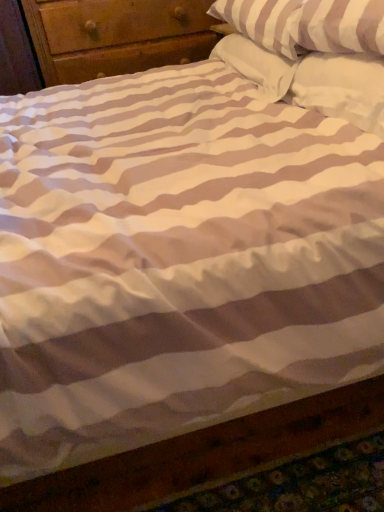
Consider the image. How much space does white striped pillow at upper right, which is counted as the second pillow, starting from the back, occupy horizontally?

It is 19.53 inches.

The height and width of the screenshot is (512, 384). In order to click on white soft pillow at upper right, the first pillow when ordered from front to back in this screenshot , I will do `click(342, 88)`.

Is white soft pillow at upper right, which is the 1th pillow from back to front, wider or thinner than white soft pillow at upper right, the 3th pillow in the back-to-front sequence?

white soft pillow at upper right, which is the 1th pillow from back to front, is wider than white soft pillow at upper right, the 3th pillow in the back-to-front sequence.

Do you think white soft pillow at upper right, which is the 1th pillow from back to front, is within white soft pillow at upper right, the first pillow when ordered from front to back, or outside of it?

white soft pillow at upper right, which is the 1th pillow from back to front, is not inside white soft pillow at upper right, the first pillow when ordered from front to back, it's outside.

Is point (331, 87) positioned behind point (344, 84)?

Yes, point (331, 87) is farther from viewer.

Between white soft pillow at upper right, which is the 1th pillow from back to front, and white soft pillow at upper right, the first pillow when ordered from front to back, which one appears on the left side from the viewer's perspective?

white soft pillow at upper right, which is the 1th pillow from back to front, is more to the left.

Is white soft pillow at upper right, the first pillow when ordered from front to back, next to white soft pillow at upper right, the 3th pillow viewed from the front?

Yes, white soft pillow at upper right, the first pillow when ordered from front to back, is beside white soft pillow at upper right, the 3th pillow viewed from the front.

Between white soft pillow at upper right, the 3th pillow in the back-to-front sequence, and white soft pillow at upper right, the 3th pillow viewed from the front, which one appears on the right side from the viewer's perspective?

white soft pillow at upper right, the 3th pillow in the back-to-front sequence.

From a real-world perspective, between white soft pillow at upper right, the first pillow when ordered from front to back, and white soft pillow at upper right, the 3th pillow viewed from the front, who is vertically higher?

white soft pillow at upper right, the first pillow when ordered from front to back, is physically above.

Does point (338, 116) appear closer or farther from the camera than point (332, 38)?

Point (338, 116) is closer to the camera than point (332, 38).

Is white striped pillow at upper right, which is counted as the second pillow, starting from the back, inside white soft pillow at upper right, the first pillow when ordered from front to back?

No, white striped pillow at upper right, which is counted as the second pillow, starting from the back, is located outside of white soft pillow at upper right, the first pillow when ordered from front to back.

Considering the sizes of objects white soft pillow at upper right, the 3th pillow in the back-to-front sequence, and white striped pillow at upper right, the 2th pillow viewed from the front, in the image provided, who is smaller, white soft pillow at upper right, the 3th pillow in the back-to-front sequence, or white striped pillow at upper right, the 2th pillow viewed from the front,?

With smaller size is white soft pillow at upper right, the 3th pillow in the back-to-front sequence.

Does white soft pillow at upper right, the 3th pillow in the back-to-front sequence, have a lesser width compared to white striped pillow at upper right, the 2th pillow viewed from the front?

Yes.

Is white striped pillow at upper right, the 2th pillow viewed from the front, not near white soft pillow at upper right, the 3th pillow in the back-to-front sequence?

No, white striped pillow at upper right, the 2th pillow viewed from the front, is not far away from white soft pillow at upper right, the 3th pillow in the back-to-front sequence.

Consider the image. From a real-world perspective, is white striped pillow at upper right, which is counted as the second pillow, starting from the back, located higher than white soft pillow at upper right, the first pillow when ordered from front to back?

Yes, from a real-world perspective, white striped pillow at upper right, which is counted as the second pillow, starting from the back, is over white soft pillow at upper right, the first pillow when ordered from front to back

Based on the photo, between white striped pillow at upper right, the 2th pillow viewed from the front, and white soft pillow at upper right, the first pillow when ordered from front to back, which one has less height?

white soft pillow at upper right, the first pillow when ordered from front to back, is shorter.

Is white striped pillow at upper right, the 2th pillow viewed from the front, oriented away from white soft pillow at upper right, the 3th pillow in the back-to-front sequence?

No, white soft pillow at upper right, the 3th pillow in the back-to-front sequence, is not at the back of white striped pillow at upper right, the 2th pillow viewed from the front.

Which is correct: white soft pillow at upper right, which is the 1th pillow from back to front, is inside white striped pillow at upper right, the 2th pillow viewed from the front, or outside of it?

white soft pillow at upper right, which is the 1th pillow from back to front, lies outside white striped pillow at upper right, the 2th pillow viewed from the front.

Consider the image. Which of these two, white soft pillow at upper right, which is the 1th pillow from back to front, or white striped pillow at upper right, the 2th pillow viewed from the front, is thinner?

With smaller width is white soft pillow at upper right, which is the 1th pillow from back to front.

Is white soft pillow at upper right, which is the 1th pillow from back to front, beside white striped pillow at upper right, which is counted as the second pillow, starting from the back?

Yes.

From the image's perspective, would you say white soft pillow at upper right, the 3th pillow viewed from the front, is shown under white striped pillow at upper right, the 2th pillow viewed from the front?

Yes.

Looking at this image, which is in front, white striped pillow at upper right, the 2th pillow viewed from the front, or white soft pillow at upper right, the 3th pillow viewed from the front?

white striped pillow at upper right, the 2th pillow viewed from the front.

From a real-world perspective, which object stands above the other?

Answer: white striped pillow at upper right, the 2th pillow viewed from the front, is physically above.

The width and height of the screenshot is (384, 512). I want to click on pillow that is the 1st one above the white soft pillow at upper right, the 3th pillow viewed from the front (from a real-world perspective), so [342, 88].

Locate an element on the screen. pillow that is the 1st object to the left of the white soft pillow at upper right, the first pillow when ordered from front to back, starting at the anchor is located at coordinates (313, 80).

Looking at the image, which one is located further to white soft pillow at upper right, the 3th pillow viewed from the front, white striped pillow at upper right, which is counted as the second pillow, starting from the back, or white soft pillow at upper right, the 3th pillow in the back-to-front sequence?

The object further to white soft pillow at upper right, the 3th pillow viewed from the front, is white striped pillow at upper right, which is counted as the second pillow, starting from the back.

Estimate the real-world distances between objects in this image. Which object is closer to white striped pillow at upper right, which is counted as the second pillow, starting from the back, white soft pillow at upper right, which is the 1th pillow from back to front, or white soft pillow at upper right, the 3th pillow in the back-to-front sequence?

Based on the image, white soft pillow at upper right, which is the 1th pillow from back to front, appears to be nearer to white striped pillow at upper right, which is counted as the second pillow, starting from the back.

Based on their spatial positions, is white soft pillow at upper right, the first pillow when ordered from front to back, or white striped pillow at upper right, which is counted as the second pillow, starting from the back, closer to white soft pillow at upper right, which is the 1th pillow from back to front?

white soft pillow at upper right, the first pillow when ordered from front to back, is positioned closer to the anchor white soft pillow at upper right, which is the 1th pillow from back to front.

In the scene shown: From the image, which object appears to be farther from white striped pillow at upper right, the 2th pillow viewed from the front, white soft pillow at upper right, the first pillow when ordered from front to back, or white soft pillow at upper right, which is the 1th pillow from back to front?

white soft pillow at upper right, the first pillow when ordered from front to back, is further to white striped pillow at upper right, the 2th pillow viewed from the front.

Estimate the real-world distances between objects in this image. Which object is further from white soft pillow at upper right, the 3th pillow in the back-to-front sequence, white striped pillow at upper right, which is counted as the second pillow, starting from the back, or white soft pillow at upper right, which is the 1th pillow from back to front?

Based on the image, white striped pillow at upper right, which is counted as the second pillow, starting from the back, appears to be further to white soft pillow at upper right, the 3th pillow in the back-to-front sequence.

Looking at the image, which one is located further to white soft pillow at upper right, the 3th pillow in the back-to-front sequence, white soft pillow at upper right, the 3th pillow viewed from the front, or white striped pillow at upper right, which is counted as the second pillow, starting from the back?

Among the two, white striped pillow at upper right, which is counted as the second pillow, starting from the back, is located further to white soft pillow at upper right, the 3th pillow in the back-to-front sequence.

Find the location of a particular element. The image size is (384, 512). pillow positioned between white soft pillow at upper right, the 3th pillow in the back-to-front sequence, and white soft pillow at upper right, which is the 1th pillow from back to front, from near to far is located at coordinates (307, 24).